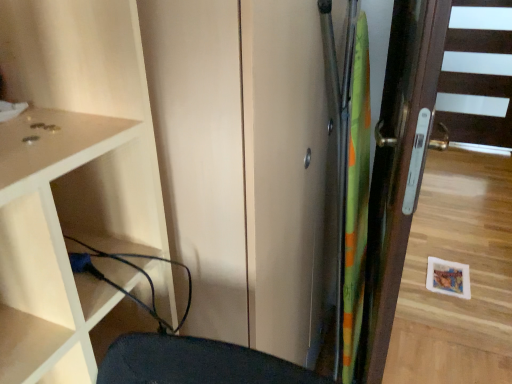
I want to click on vacant area situated below brown wooden door at right (from a real-world perspective), so click(x=451, y=337).